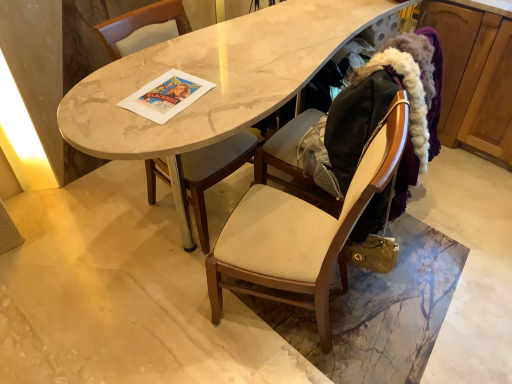
Question: Can you confirm if beige fabric chair at center, the first chair in the right-to-left sequence, is bigger than marble table at center?

Choices:
 (A) yes
 (B) no

Answer: (B)

Question: Considering the relative sizes of beige fabric chair at center, marked as the 2th chair in a left-to-right arrangement, and marble table at center in the image provided, is beige fabric chair at center, marked as the 2th chair in a left-to-right arrangement, thinner than marble table at center?

Choices:
 (A) no
 (B) yes

Answer: (B)

Question: Is beige fabric chair at center, marked as the 2th chair in a left-to-right arrangement, oriented away from marble table at center?

Choices:
 (A) no
 (B) yes

Answer: (A)

Question: Would you consider beige fabric chair at center, the first chair in the right-to-left sequence, to be distant from marble table at center?

Choices:
 (A) yes
 (B) no

Answer: (B)

Question: Is beige fabric chair at center, the first chair in the right-to-left sequence, wider than marble table at center?

Choices:
 (A) yes
 (B) no

Answer: (B)

Question: From the image's perspective, is wooden cabinet at right above or below beige fabric folding chair at right?

Choices:
 (A) above
 (B) below

Answer: (A)

Question: From a real-world perspective, is wooden cabinet at right physically located above or below beige fabric folding chair at right?

Choices:
 (A) above
 (B) below

Answer: (B)

Question: Considering their positions, is wooden cabinet at right located in front of or behind beige fabric folding chair at right?

Choices:
 (A) front
 (B) behind

Answer: (B)

Question: Considering the positions of point (501, 150) and point (348, 175), is point (501, 150) closer or farther from the camera than point (348, 175)?

Choices:
 (A) farther
 (B) closer

Answer: (A)

Question: Does point (232, 160) appear closer or farther from the camera than point (251, 18)?

Choices:
 (A) closer
 (B) farther

Answer: (A)

Question: Would you say matte gray cushioned chair at center, which appears as the 2th chair when viewed from the right, is to the left or to the right of marble table at center in the picture?

Choices:
 (A) right
 (B) left

Answer: (B)

Question: Is matte gray cushioned chair at center, which appears as the 2th chair when viewed from the right, wider or thinner than marble table at center?

Choices:
 (A) thin
 (B) wide

Answer: (A)

Question: From the image's perspective, relative to marble table at center, is matte gray cushioned chair at center, which appears as the 2th chair when viewed from the right, above or below?

Choices:
 (A) above
 (B) below

Answer: (B)

Question: Is marble table at center inside the boundaries of beige fabric chair at center, the first chair in the right-to-left sequence, or outside?

Choices:
 (A) outside
 (B) inside

Answer: (A)

Question: In the image, is marble table at center positioned in front of or behind beige fabric chair at center, the first chair in the right-to-left sequence?

Choices:
 (A) behind
 (B) front

Answer: (A)